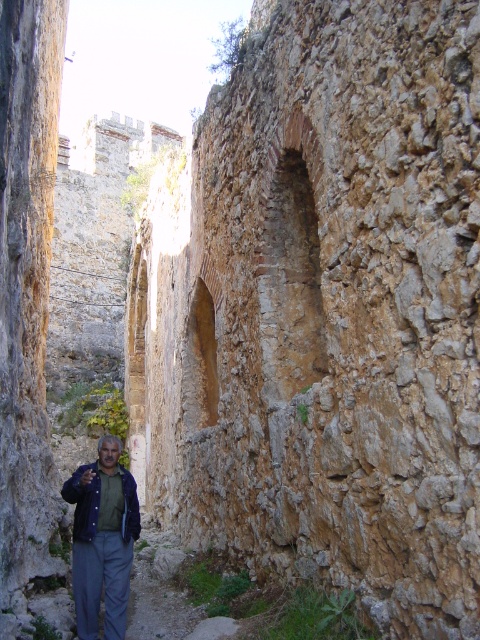
You are standing in the narrow alleyway depicted in the image. You need to locate the brown rough stone wall at center. Where would you look in the image to find it?

The brown rough stone wall at center is located at point coordinates of (324, 314).

You are a delivery person carrying a package and need to navigate through the narrow alleyway shown. You see the brown rough stone wall at center and the blue denim jacket at lower left. Which object is wider, and does this affect your path?

The brown rough stone wall at center is wider than the blue denim jacket at lower left. Since the alleyway is narrow, the wider wall may require more caution when navigating, but the jacket is narrower and less of an obstruction.

You are a traveler standing in the narrow alleyway between two ancient stone walls. You notice a blue denim jacket at lower left and a brown rough stone wall at center. Which object is taller?

The brown rough stone wall at center is taller than the blue denim jacket at lower left.